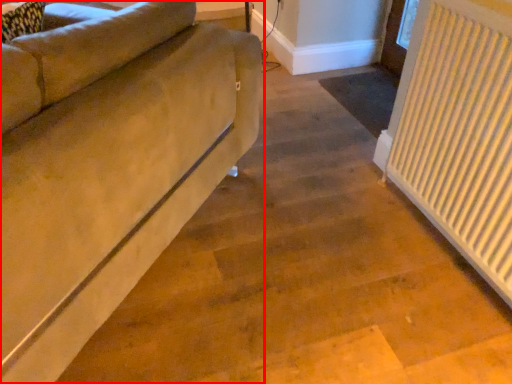
Question: From the image's perspective, what is the correct spatial relationship of studio couch (annotated by the red box) in relation to radiator?

Choices:
 (A) below
 (B) above

Answer: (B)